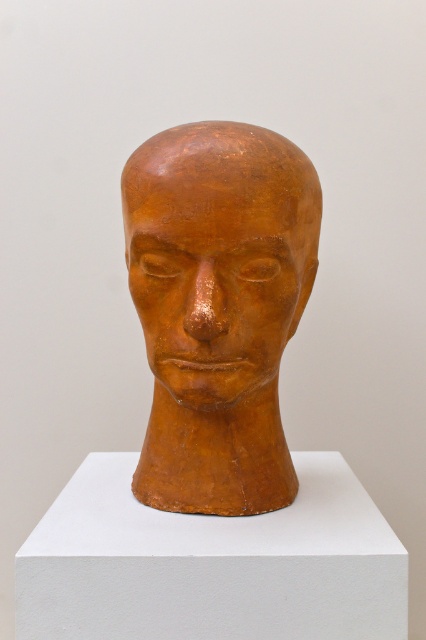
Question: Which point appears farthest from the camera in this image?

Choices:
 (A) (163, 371)
 (B) (134, 257)

Answer: (A)

Question: Observing the image, what is the correct spatial positioning of matte orange head at center in reference to matte clay face at center?

Choices:
 (A) left
 (B) right

Answer: (A)

Question: Is matte orange head at center smaller than matte clay face at center?

Choices:
 (A) no
 (B) yes

Answer: (A)

Question: Does matte orange head at center have a smaller size compared to matte clay face at center?

Choices:
 (A) no
 (B) yes

Answer: (A)

Question: Among these points, which one is nearest to the camera?

Choices:
 (A) (244, 381)
 (B) (196, 305)

Answer: (B)